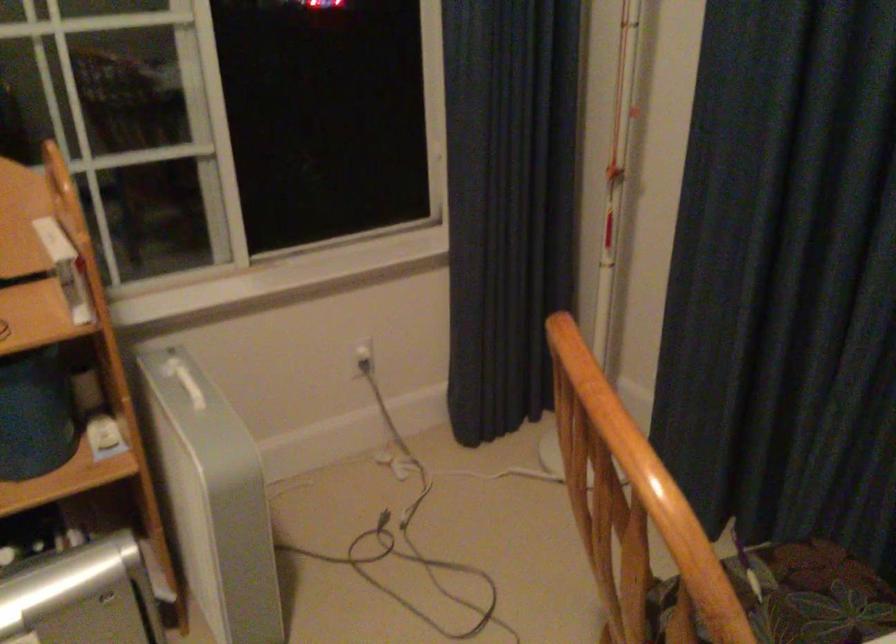
Identify the location of white electrical plug. (363, 355).